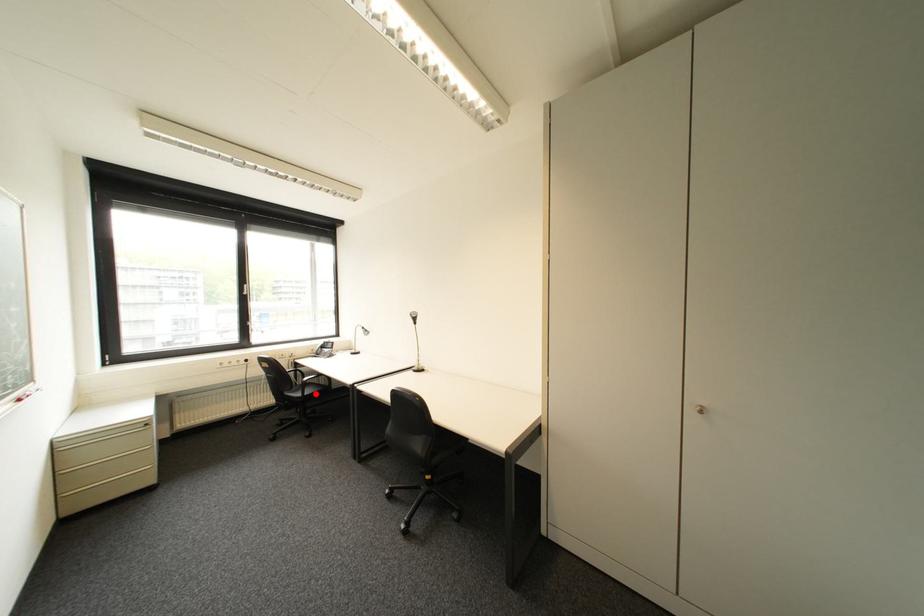
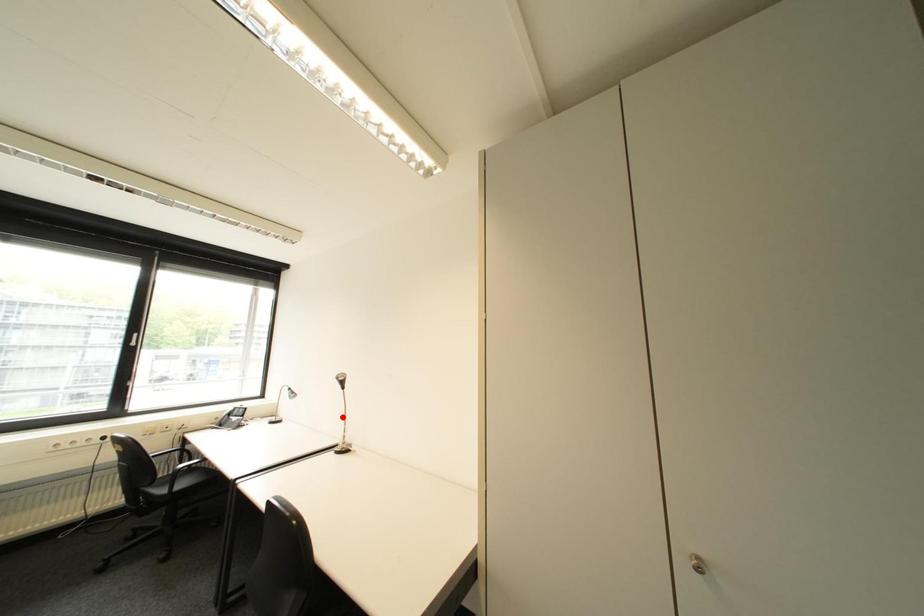
I am providing you with two images of the same scene from different viewpoints. A red point is marked on the first image and another point is marked on the second image. Are the points marked in image1 and image2 representing the same 3D position?

No